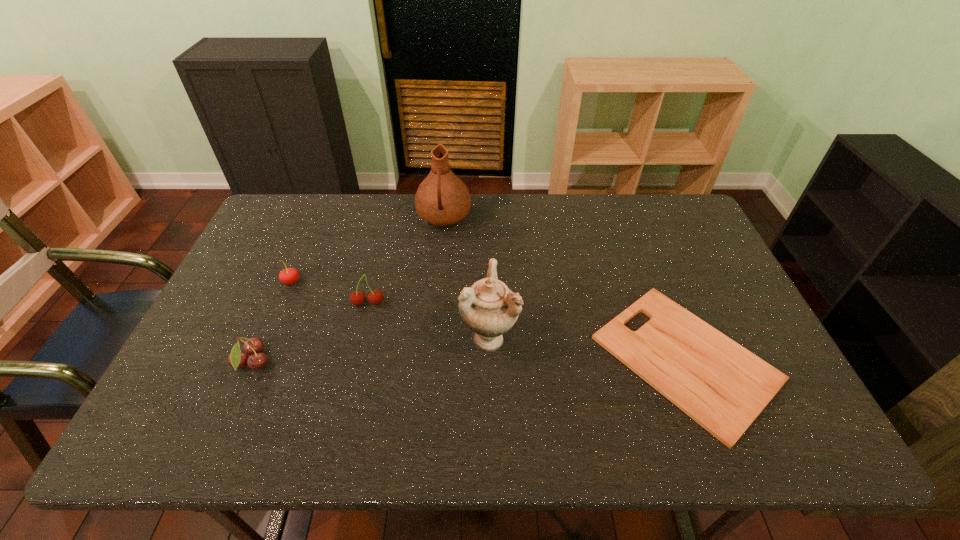
Locate an element on the screen. The height and width of the screenshot is (540, 960). vacant space at the left edge of the desktop is located at coordinates (189, 379).

Locate an element on the screen. Image resolution: width=960 pixels, height=540 pixels. free spot at the far left corner of the desktop is located at coordinates (315, 213).

I want to click on vacant space at the near left corner of the desktop, so click(173, 447).

Image resolution: width=960 pixels, height=540 pixels. Identify the location of vacant region at the far right corner. (702, 236).

Locate an element on the screen. vacant area that lies between the rightmost object and the nearest cherry is located at coordinates (468, 361).

Locate an element on the screen. vacant region between the pitcher and the fourth shortest object is located at coordinates (406, 261).

Find the location of a particular element. This screenshot has width=960, height=540. free spot between the tallest cherry and the urn is located at coordinates (428, 321).

This screenshot has width=960, height=540. Find the location of `vacant area between the urn and the nearest cherry`. vacant area between the urn and the nearest cherry is located at coordinates (371, 350).

Locate an element on the screen. free spot between the tallest cherry and the farthest cherry is located at coordinates (330, 293).

The height and width of the screenshot is (540, 960). What are the coordinates of `vacant area that lies between the rightmost cherry and the urn` in the screenshot? It's located at (428, 321).